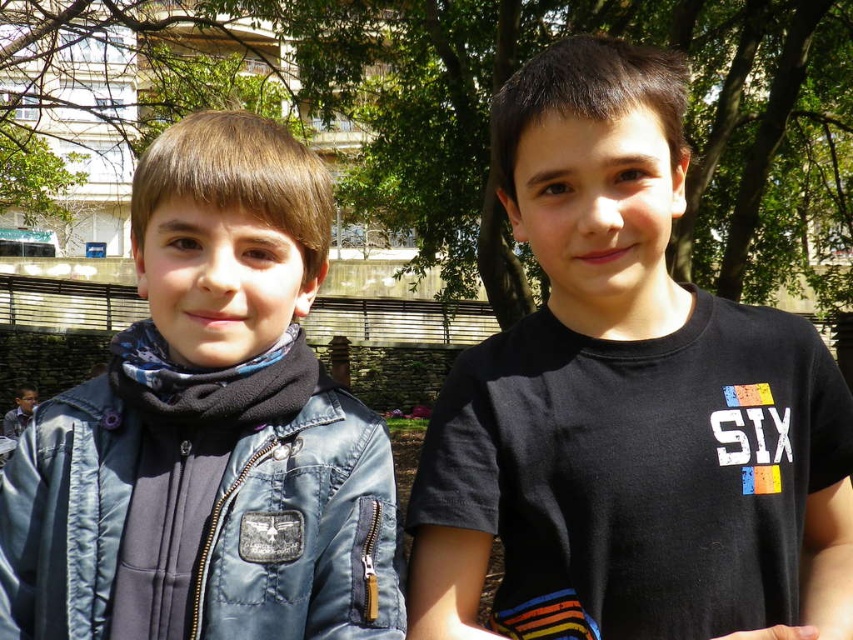
Does black matte shirt at center have a larger size compared to brushed denim jacket at left?

Yes.

Is black matte shirt at center taller than brushed denim jacket at left?

Indeed, black matte shirt at center has a greater height compared to brushed denim jacket at left.

Where is `black matte shirt at center`? This screenshot has width=853, height=640. black matte shirt at center is located at coordinates (628, 403).